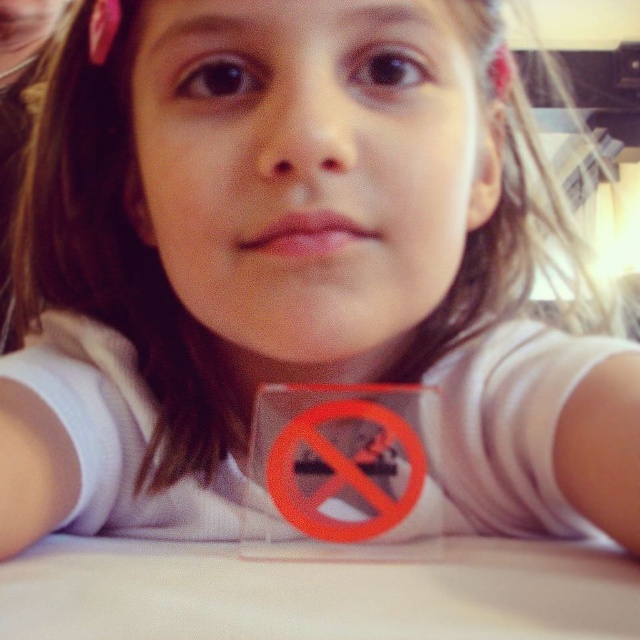
Question: Which point appears closest to the camera in this image?

Choices:
 (A) (506, 548)
 (B) (403, 502)

Answer: (B)

Question: Does white matte table at center appear under orange plastic sign at center?

Choices:
 (A) yes
 (B) no

Answer: (A)

Question: Is white matte table at center below orange plastic sign at center?

Choices:
 (A) no
 (B) yes

Answer: (B)

Question: Is white matte table at center positioned at the back of orange plastic sign at center?

Choices:
 (A) no
 (B) yes

Answer: (A)

Question: Which point is closer to the camera?

Choices:
 (A) (252, 436)
 (B) (106, 580)

Answer: (B)

Question: Which object is closer to the camera taking this photo?

Choices:
 (A) orange plastic sign at center
 (B) white matte table at center

Answer: (B)